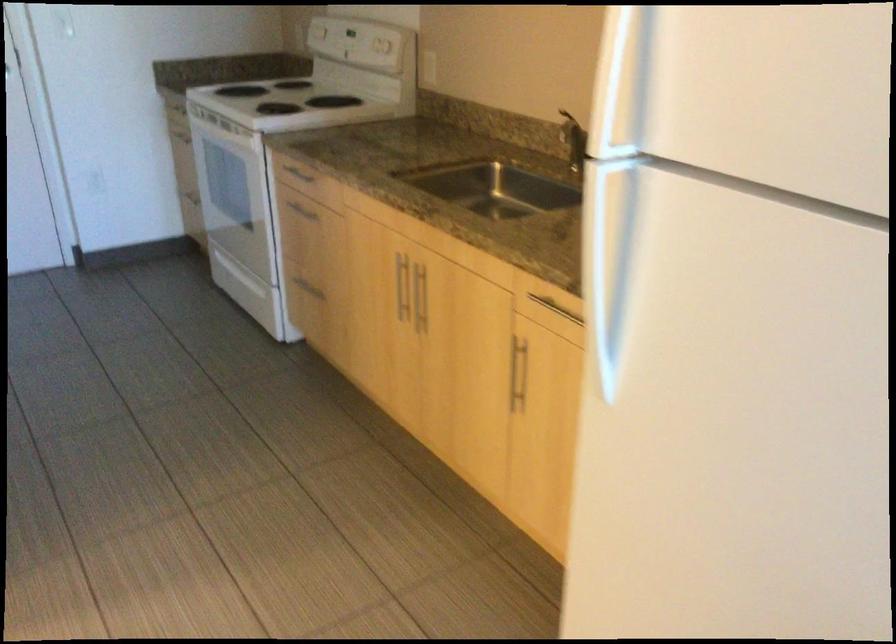
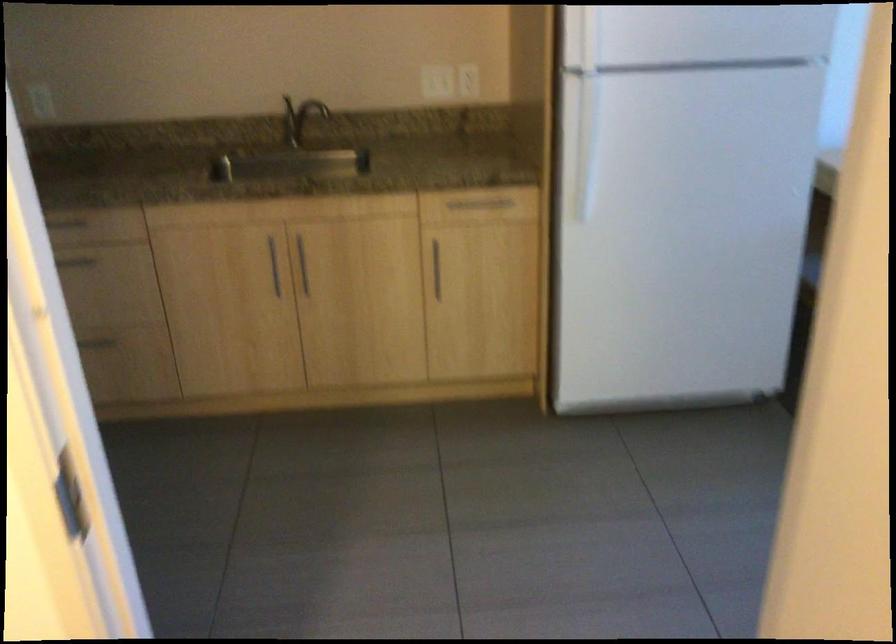
Where in the second image is the point corresponding to [612,281] from the first image?

(586, 146)